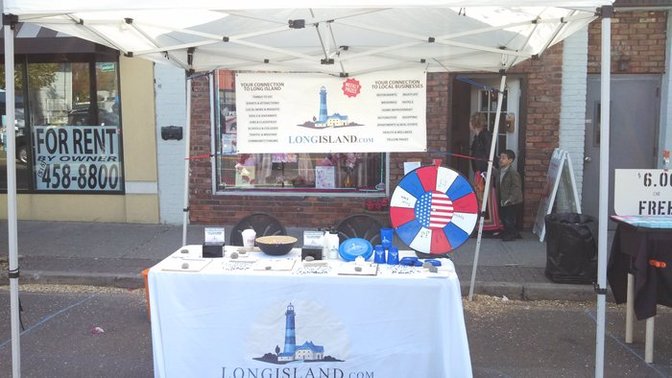
Find the location of a particular element. trash can is located at coordinates (581, 243).